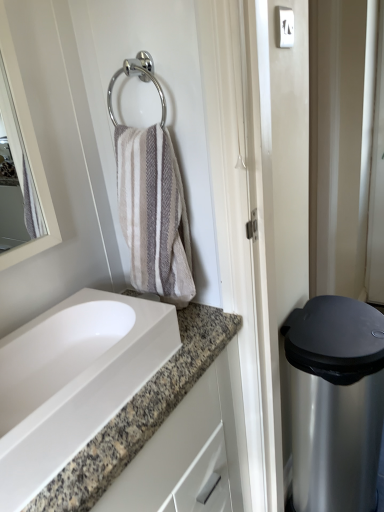
Question: Would you consider chrome metallic towel ring at upper center to be distant from white glossy sink at lower left?

Choices:
 (A) yes
 (B) no

Answer: (B)

Question: Does chrome metallic towel ring at upper center appear on the right side of white glossy sink at lower left?

Choices:
 (A) yes
 (B) no

Answer: (A)

Question: Does chrome metallic towel ring at upper center come behind white glossy sink at lower left?

Choices:
 (A) yes
 (B) no

Answer: (A)

Question: From a real-world perspective, does chrome metallic towel ring at upper center sit lower than white glossy sink at lower left?

Choices:
 (A) yes
 (B) no

Answer: (B)

Question: Does chrome metallic towel ring at upper center have a greater width compared to white glossy sink at lower left?

Choices:
 (A) no
 (B) yes

Answer: (A)

Question: Is chrome metallic towel ring at upper center in front of or behind white glossy sink at lower left in the image?

Choices:
 (A) front
 (B) behind

Answer: (B)

Question: From the image's perspective, is chrome metallic towel ring at upper center above or below white glossy sink at lower left?

Choices:
 (A) above
 (B) below

Answer: (A)

Question: Looking at the image, does chrome metallic towel ring at upper center seem bigger or smaller compared to white glossy sink at lower left?

Choices:
 (A) big
 (B) small

Answer: (B)

Question: Would you say chrome metallic towel ring at upper center is inside or outside white glossy sink at lower left?

Choices:
 (A) outside
 (B) inside

Answer: (A)

Question: Is white glossy sink at lower left wider or thinner than satin silver trash can at right?

Choices:
 (A) thin
 (B) wide

Answer: (A)

Question: Looking at the image, does white glossy sink at lower left seem bigger or smaller compared to satin silver trash can at right?

Choices:
 (A) big
 (B) small

Answer: (B)

Question: In the image, is white glossy sink at lower left positioned in front of or behind satin silver trash can at right?

Choices:
 (A) behind
 (B) front

Answer: (B)

Question: Considering the positions of point (1, 460) and point (349, 477), is point (1, 460) closer or farther from the camera than point (349, 477)?

Choices:
 (A) closer
 (B) farther

Answer: (A)

Question: Based on their sizes in the image, would you say satin silver trash can at right is bigger or smaller than chrome metallic towel ring at upper center?

Choices:
 (A) big
 (B) small

Answer: (A)

Question: From the image's perspective, relative to chrome metallic towel ring at upper center, is satin silver trash can at right above or below?

Choices:
 (A) below
 (B) above

Answer: (A)